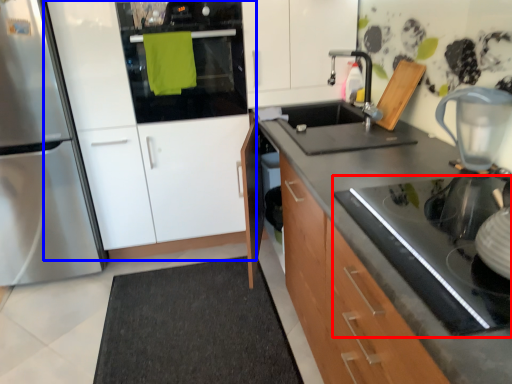
Question: Which of the following is the closest to the observer, gas stove (highlighted by a red box) or cabinetry (highlighted by a blue box)?

Choices:
 (A) gas stove
 (B) cabinetry

Answer: (A)